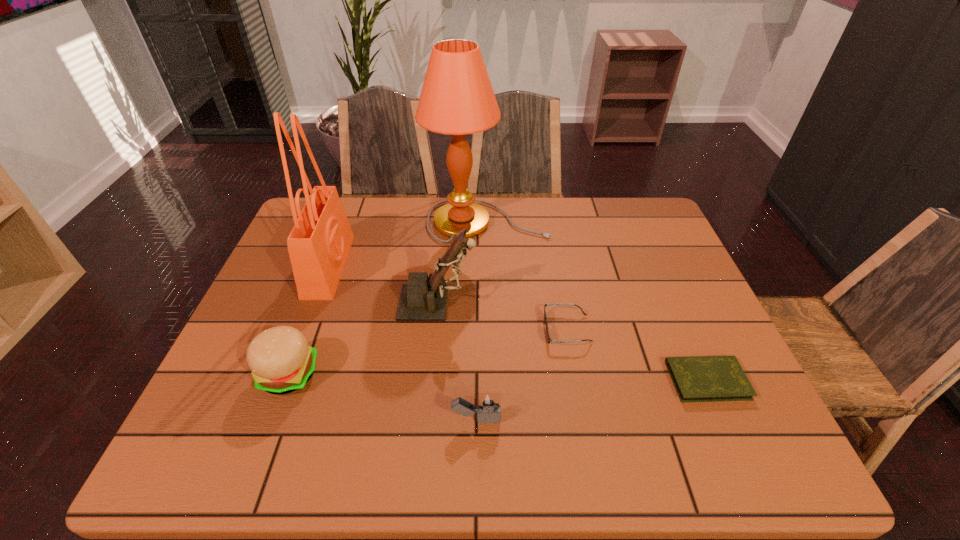
You are a GUI agent. You are given a task and a screenshot of the screen. Output one action in this format:
    pyautogui.click(x=<x>, y=<y>)
    Task: Click on the free spot that satisfies the following two spatial constraints: 1. on the front side of the lamp; 2. on the front-facing side of the figurine
    The height and width of the screenshot is (540, 960).
    Given the screenshot: What is the action you would take?
    pyautogui.click(x=490, y=302)

Locate an element on the screen. Image resolution: width=960 pixels, height=540 pixels. free space that satisfies the following two spatial constraints: 1. on the front-facing side of the figurine; 2. on the right side of the rightmost object is located at coordinates (430, 380).

The width and height of the screenshot is (960, 540). What are the coordinates of `vacant area that satisfies the following two spatial constraints: 1. on the logo side of the nearest object; 2. on the left side of the second tallest object` in the screenshot? It's located at (271, 420).

You are a GUI agent. You are given a task and a screenshot of the screen. Output one action in this format:
    pyautogui.click(x=<x>, y=<y>)
    Task: Click on the free space that satisfies the following two spatial constraints: 1. on the front-facing side of the sunglasses; 2. on the front side of the nearest object
    
    Given the screenshot: What is the action you would take?
    pyautogui.click(x=584, y=420)

Find the location of a particular element. The width and height of the screenshot is (960, 540). vacant position in the image that satisfies the following two spatial constraints: 1. on the back side of the diary; 2. on the front-facing side of the sunglasses is located at coordinates (684, 329).